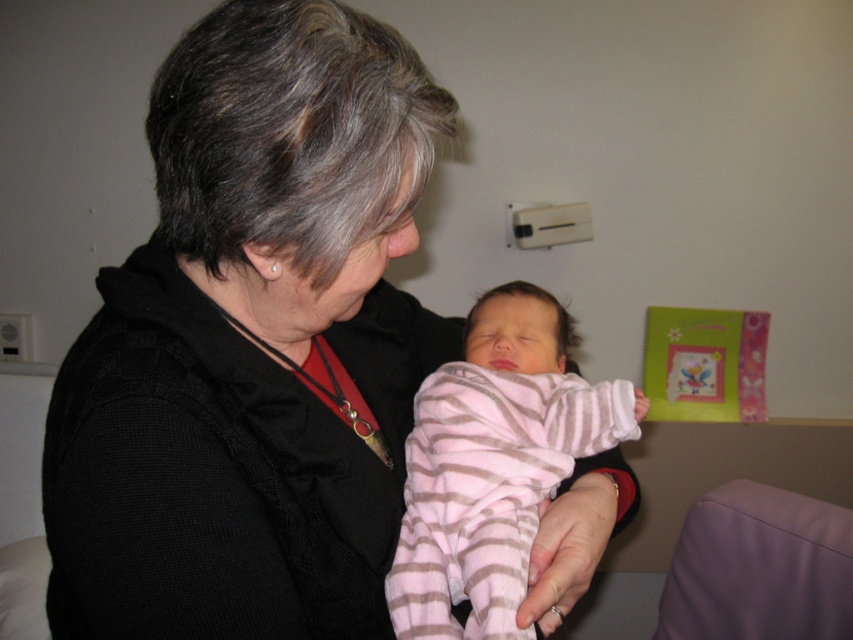
You are a nurse in a hospital room and you notice the pink striped fabric baby at center and the pink striped fabric at center. Are they touching each other?

The pink striped fabric baby at center is 3.16 inches away from the pink striped fabric at center, so they are not touching each other.